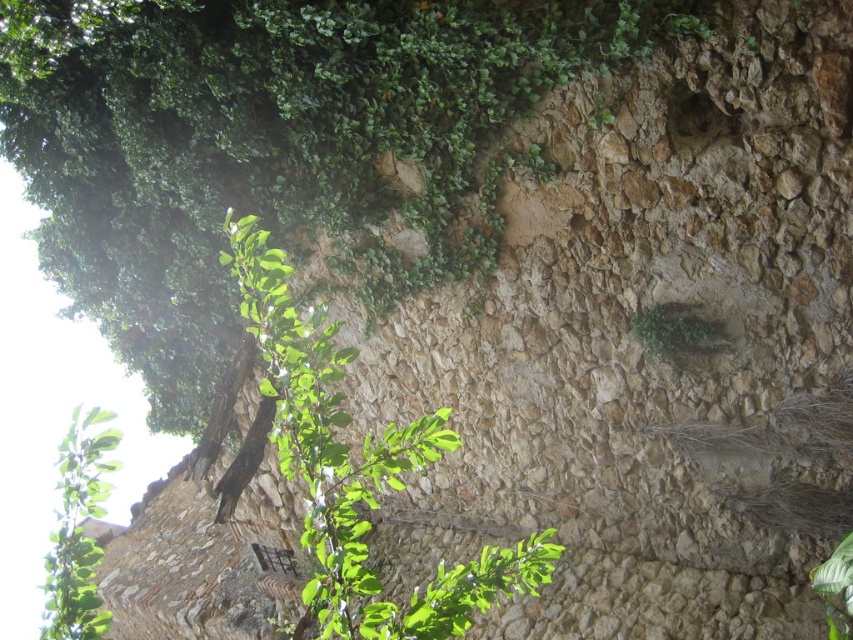
Question: Is green leafy branch at upper left bigger than green leafy plant at center?

Choices:
 (A) yes
 (B) no

Answer: (A)

Question: Is green leafy branch at upper left positioned behind green leafy plant at center?

Choices:
 (A) yes
 (B) no

Answer: (B)

Question: Which point is farther from the camera taking this photo?

Choices:
 (A) (78, 490)
 (B) (682, 316)

Answer: (B)

Question: Which of the following is the closest to the observer?

Choices:
 (A) (84, 467)
 (B) (657, 333)

Answer: (A)

Question: Which object appears closest to the camera in this image?

Choices:
 (A) green leafy plant at center
 (B) green leafy branch at upper left

Answer: (B)

Question: Observing the image, what is the correct spatial positioning of green leafy branch at upper left in reference to green leafy plant at center?

Choices:
 (A) left
 (B) right

Answer: (A)